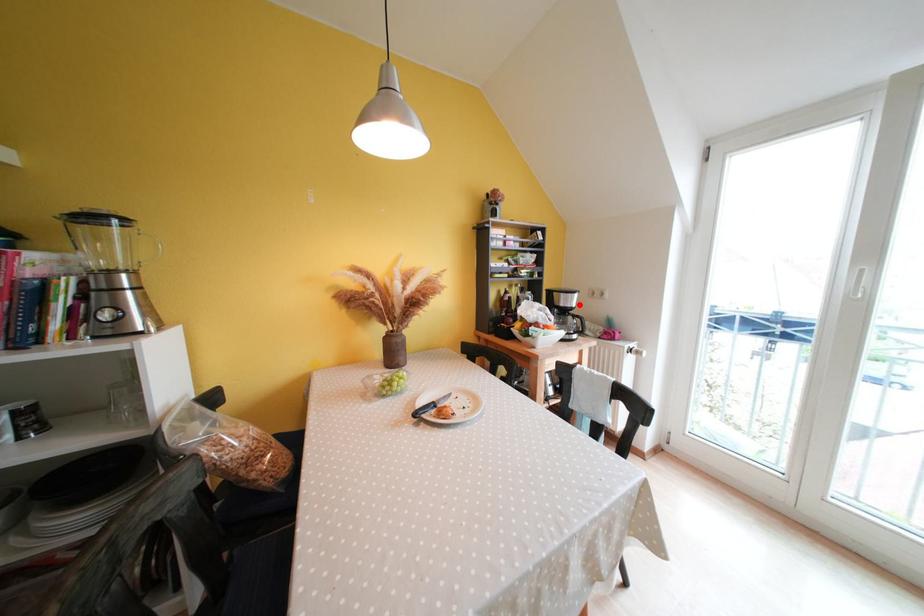
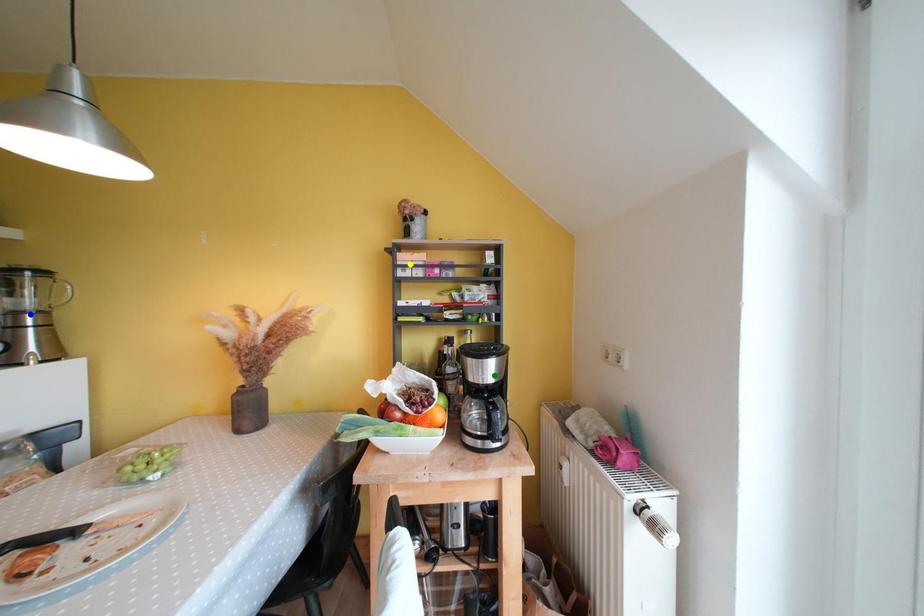
Question: I am providing you with two images of the same scene from different viewpoints. A red point is marked on the first image. You are given multiple points on the second image. Which spot in image 2 lines up with the point in image 1?

Choices:
 (A) yellow point
 (B) green point
 (C) blue point

Answer: (B)